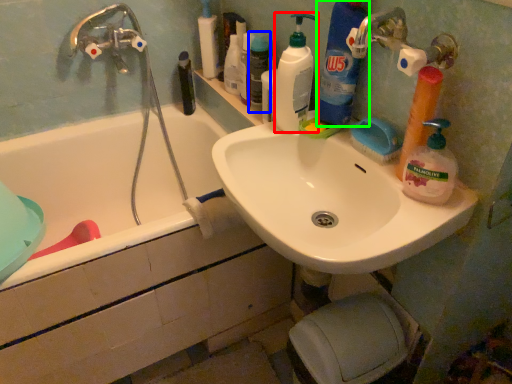
Question: Based on their relative distances, which object is nearer to cleaning product (highlighted by a red box)? Choose from toiletry (highlighted by a blue box) and cleaning product (highlighted by a green box).

Choices:
 (A) toiletry
 (B) cleaning product

Answer: (B)